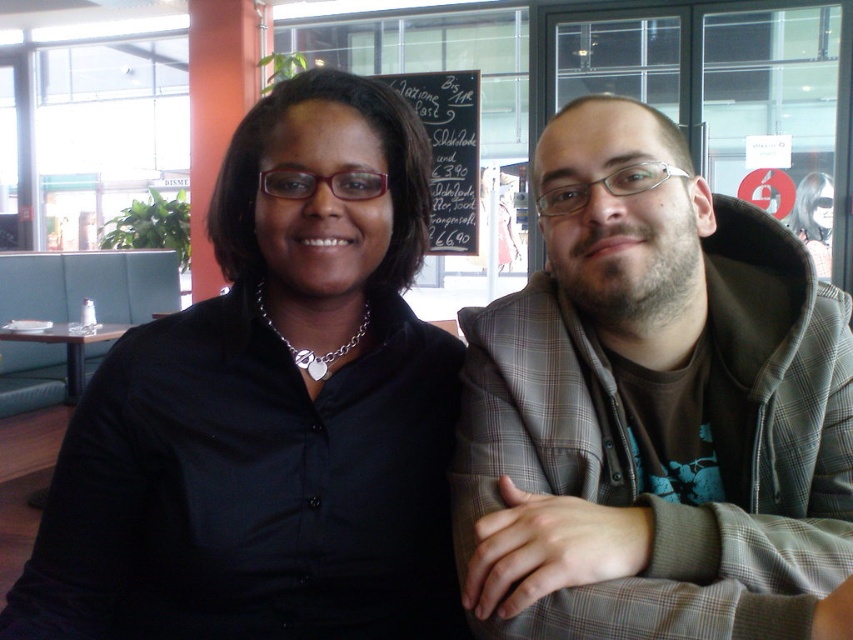
You are standing in the cafe and want to take a photo of the black shirt at center. Where should you aim your camera?

The black shirt at center is located at coordinates point 0.642 on the x axis and 0.319 on the y axis, so aim your camera there.

You are a photographer adjusting your camera to focus on two points in the scene. The first point is at coordinates point (467, 568) and the second is at point (47, 330). Which point should you focus on first if you want to capture the closest object to the camera?

Point (467, 568) is closer to the viewer than point (47, 330), so you should focus on point (467, 568) first to capture the closest object.